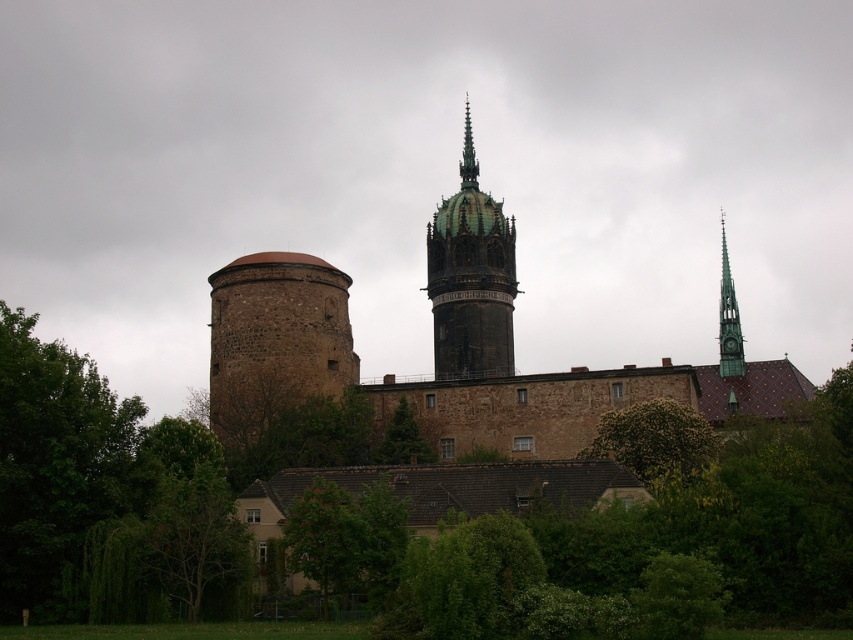
Question: Which point is farther to the camera?

Choices:
 (A) dark brown stone tower at center
 (B) brown stone tower at left

Answer: (A)

Question: Can you confirm if green glass spire at right is positioned below green leafy tree at center?

Choices:
 (A) yes
 (B) no

Answer: (B)

Question: Based on their relative distances, which object is farther from the green leafy tree at center?

Choices:
 (A) green glass spire at right
 (B) brown stone tower at left
 (C) green leafy tree at lower left

Answer: (A)

Question: Is green leafy tree at lower left positioned at the back of green glass spire at right?

Choices:
 (A) no
 (B) yes

Answer: (A)

Question: Is green leafy tree at lower left above shiny dark green spire at upper center?

Choices:
 (A) no
 (B) yes

Answer: (A)

Question: Which object is farther from the camera taking this photo?

Choices:
 (A) green leafy tree at center
 (B) green glass spire at right
 (C) green leafy tree at lower center
 (D) dark brown stone tower at center

Answer: (B)